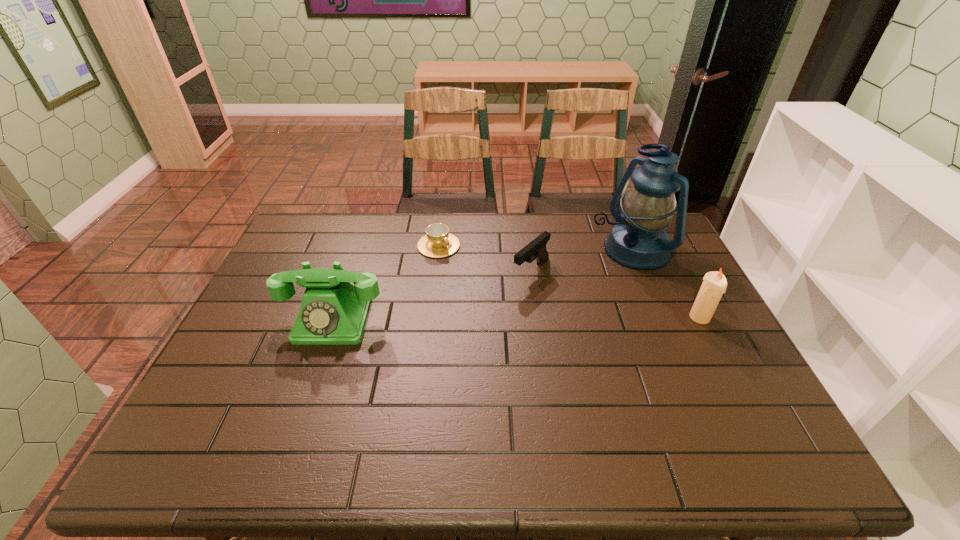
Where is `vacant space that is in between the third object from left to right and the telephone`? The image size is (960, 540). vacant space that is in between the third object from left to right and the telephone is located at coordinates (432, 295).

Image resolution: width=960 pixels, height=540 pixels. Identify the location of free spot between the second shortest object and the lantern. (581, 260).

Image resolution: width=960 pixels, height=540 pixels. In order to click on empty space that is in between the pistol and the candle in this screenshot , I will do `click(615, 294)`.

Locate an element on the screen. This screenshot has width=960, height=540. free space between the candle and the tallest object is located at coordinates (665, 284).

Where is `empty space that is in between the candle and the pistol`? The image size is (960, 540). empty space that is in between the candle and the pistol is located at coordinates (615, 294).

Locate an element on the screen. This screenshot has width=960, height=540. free space between the lantern and the leftmost object is located at coordinates (482, 285).

Where is `vacant area between the candle and the second shortest object`? Image resolution: width=960 pixels, height=540 pixels. vacant area between the candle and the second shortest object is located at coordinates (615, 294).

You are a GUI agent. You are given a task and a screenshot of the screen. Output one action in this format:
    pyautogui.click(x=<x>, y=<y>)
    Task: Click on the third closest object to the leftmost object
    
    Given the screenshot: What is the action you would take?
    638,240

Identify which object is the fourth nearest to the leftmost object. Please provide its 2D coordinates. Your answer should be formatted as a tuple, i.e. [(x, y)], where the tuple contains the x and y coordinates of a point satisfying the conditions above.

[(714, 284)]

The width and height of the screenshot is (960, 540). I want to click on vacant space that satisfies the following two spatial constraints: 1. on the front side of the fourth tallest object; 2. on the right side of the second object from left to right, so click(436, 271).